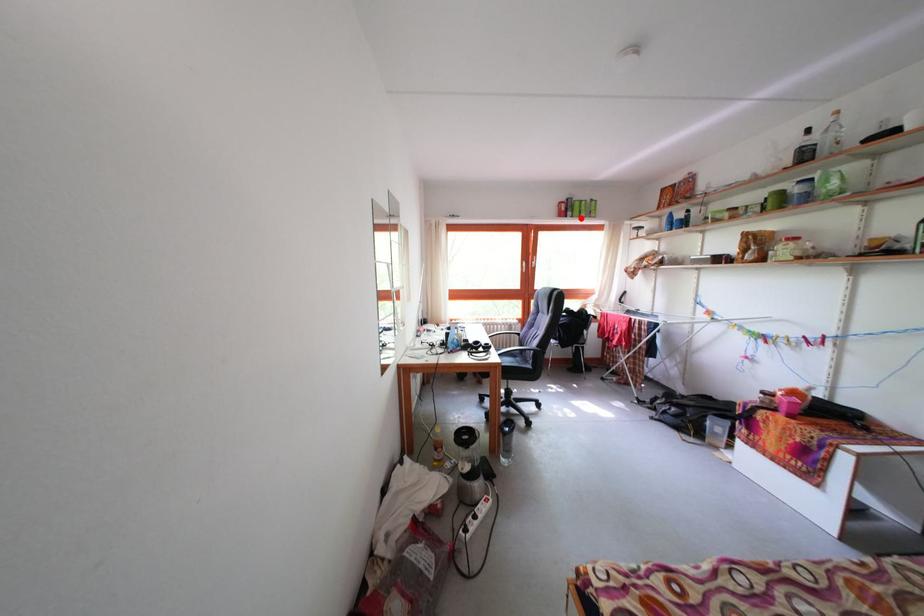
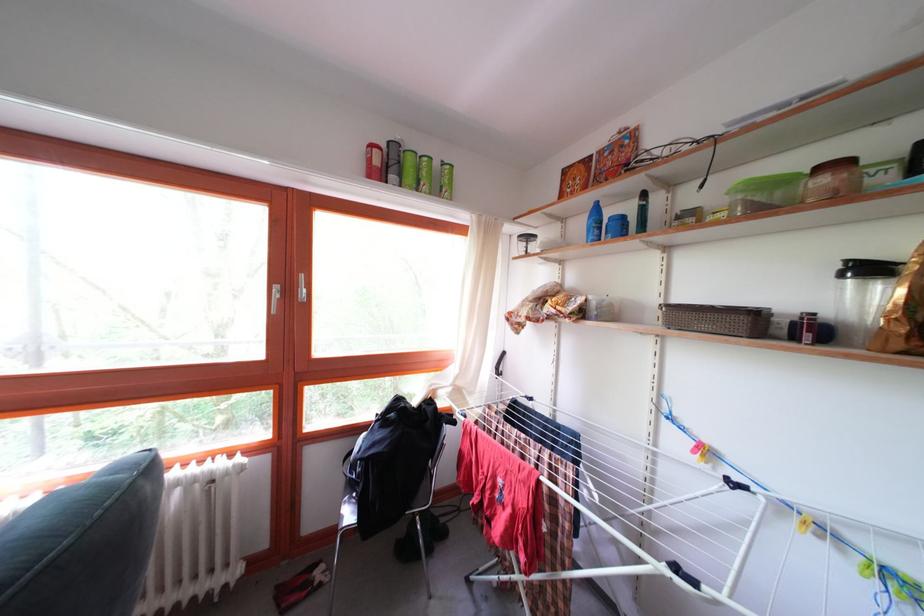
In the second image, find the point that corresponds to the highlighted location in the first image.

(409, 180)